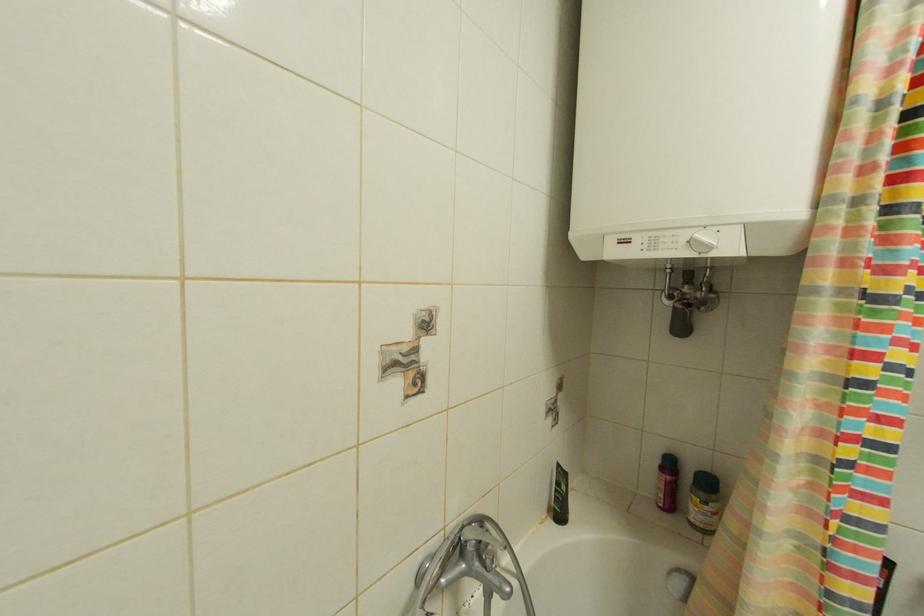
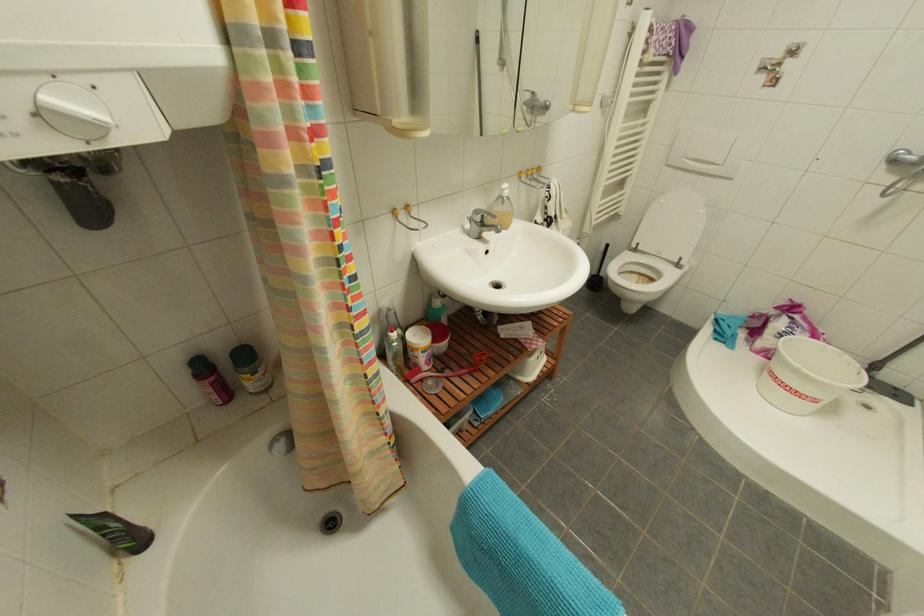
The first image is from the beginning of the video and the second image is from the end. How did the camera likely rotate when shooting the video?

The camera rotated toward right-down.